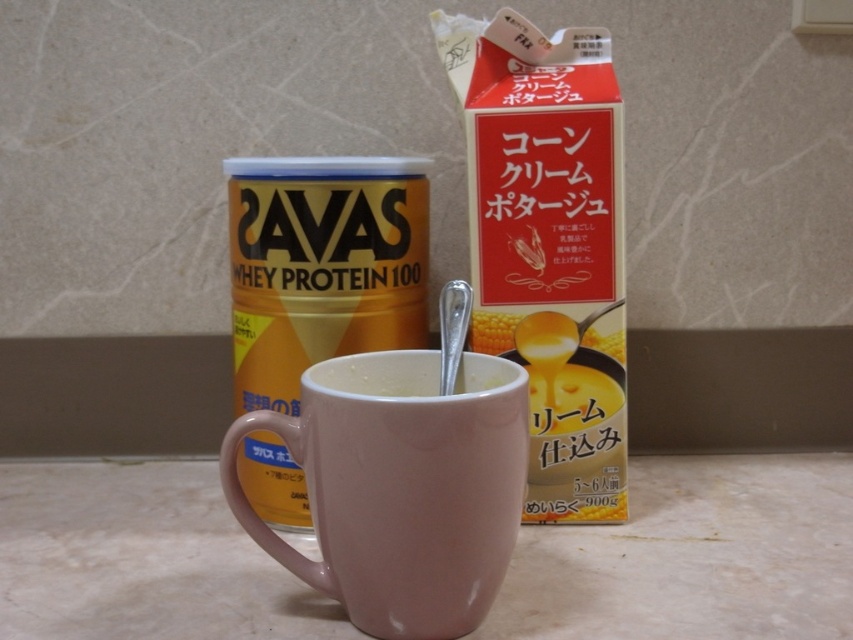
Question: Can you confirm if pink glossy mug at center is thinner than matte ceramic mug at center?

Choices:
 (A) no
 (B) yes

Answer: (A)

Question: Which of these objects is positioned farthest from the white matte mug at center?

Choices:
 (A) matte ceramic mug at center
 (B) pink glossy mug at center

Answer: (A)

Question: From the image, what is the correct spatial relationship of pink glossy mug at center in relation to white matte mug at center?

Choices:
 (A) left
 (B) right

Answer: (A)

Question: Does matte ceramic mug at center have a larger size compared to white matte mug at center?

Choices:
 (A) no
 (B) yes

Answer: (B)

Question: Considering the real-world distances, which object is farthest from the matte ceramic mug at center?

Choices:
 (A) pink glossy mug at center
 (B) white matte mug at center

Answer: (A)

Question: Which point appears farthest from the camera in this image?

Choices:
 (A) (471, 376)
 (B) (404, 214)

Answer: (B)